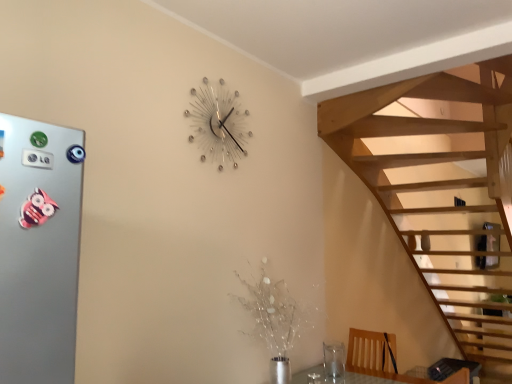
Question: From a real-world perspective, is metallic silver wall clock at upper center on transparent glass vase at lower right?

Choices:
 (A) no
 (B) yes

Answer: (B)

Question: Is the position of metallic silver wall clock at upper center more distant than that of transparent glass vase at lower right?

Choices:
 (A) yes
 (B) no

Answer: (B)

Question: Would you say metallic silver wall clock at upper center is outside transparent glass vase at lower right?

Choices:
 (A) no
 (B) yes

Answer: (B)

Question: Could you tell me if metallic silver wall clock at upper center is turned towards transparent glass vase at lower right?

Choices:
 (A) no
 (B) yes

Answer: (A)

Question: From the image's perspective, would you say metallic silver wall clock at upper center is positioned over transparent glass vase at lower right?

Choices:
 (A) no
 (B) yes

Answer: (B)

Question: Looking at the image, does silver metallic button at left seem bigger or smaller compared to transparent glass vase at lower right?

Choices:
 (A) small
 (B) big

Answer: (A)

Question: Considering the positions of silver metallic button at left and transparent glass vase at lower right in the image, is silver metallic button at left taller or shorter than transparent glass vase at lower right?

Choices:
 (A) short
 (B) tall

Answer: (A)

Question: From the image's perspective, is silver metallic button at left located above or below transparent glass vase at lower right?

Choices:
 (A) below
 (B) above

Answer: (B)

Question: Is point (46, 155) positioned closer to the camera than point (344, 357)?

Choices:
 (A) closer
 (B) farther

Answer: (A)

Question: From the image's perspective, relative to metallic silver wall clock at upper center, is silver metallic button at left above or below?

Choices:
 (A) below
 (B) above

Answer: (A)

Question: From a real-world perspective, is silver metallic button at left physically located above or below metallic silver wall clock at upper center?

Choices:
 (A) below
 (B) above

Answer: (A)

Question: Is point (47, 165) positioned closer to the camera than point (210, 145)?

Choices:
 (A) farther
 (B) closer

Answer: (B)

Question: Visually, is silver metallic button at left positioned to the left or to the right of metallic silver wall clock at upper center?

Choices:
 (A) left
 (B) right

Answer: (A)

Question: Looking at their shapes, would you say metallic silver wall clock at upper center is wider or thinner than silver metallic button at left?

Choices:
 (A) thin
 (B) wide

Answer: (B)

Question: Would you say metallic silver wall clock at upper center is to the left or to the right of silver metallic button at left in the picture?

Choices:
 (A) left
 (B) right

Answer: (B)